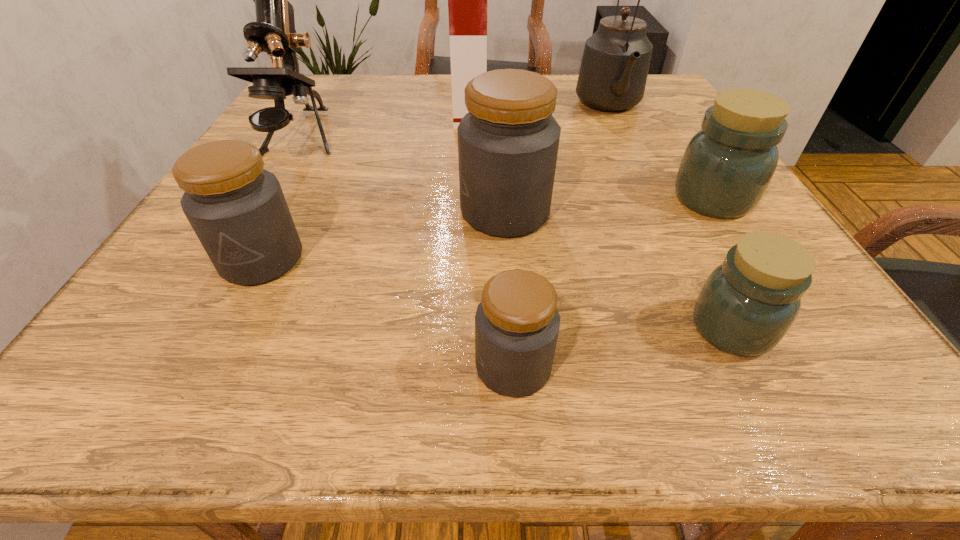
You are a GUI agent. You are given a task and a screenshot of the screen. Output one action in this format:
    pyautogui.click(x=<x>, y=<y>)
    Task: Click on the object present at the near right corner
    
    Given the screenshot: What is the action you would take?
    pos(746,306)

The width and height of the screenshot is (960, 540). In the image, there is a desktop. Find the location of `free region at the far edge`. free region at the far edge is located at coordinates (574, 103).

Find the location of a particular element. This screenshot has width=960, height=540. vacant space at the near edge is located at coordinates (558, 344).

Identify the location of free space at the left edge of the desktop. (338, 118).

Find the location of `free space at the far right corner of the desktop`. free space at the far right corner of the desktop is located at coordinates (683, 109).

I want to click on vacant area at the near right corner, so click(759, 388).

The width and height of the screenshot is (960, 540). I want to click on vacant point located between the cigarette_case and the nearer green jar, so click(x=601, y=218).

I want to click on blank region between the cigarette_case and the microscope, so click(x=386, y=124).

You are a GUI agent. You are given a task and a screenshot of the screen. Output one action in this format:
    pyautogui.click(x=<x>, y=<y>)
    Task: Click on the free spot between the smallest gray jar and the farther green jar
    This screenshot has height=540, width=960.
    Given the screenshot: What is the action you would take?
    pyautogui.click(x=612, y=282)

Locate an element on the screen. Image resolution: width=960 pixels, height=540 pixels. vacant area that lies between the fourth tallest object and the microscope is located at coordinates point(403,177).